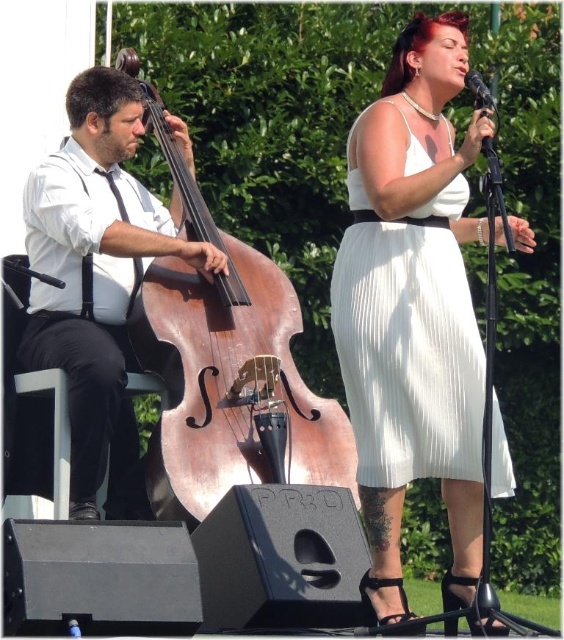
You are a stagehand setting up a storage area. You need to place the matte black double bass at left and the white pleated dress at center into a storage closet. The closet has a maximum capacity of 2 meters in height. Can both items fit vertically in the closet if the double bass is 1.8 meters tall and the dress is 1.2 meters tall?

The matte black double bass at left is bigger than the white pleated dress at center. The double bass is 1.8 meters tall, which exceeds the 2 meters height limit of the closet. Therefore, the double bass cannot fit vertically in the closet, and neither can the dress be placed alongside it since the bass alone is too tall.

You are a stagehand adjusting the lighting for the performance. You need to position a spotlight so it shines on both the matte black double bass at left and the black matte microphone at upper right. Given their positions, which object should you aim the spotlight towards first to ensure both are illuminated?

Since the matte black double bass at left is to the left of the black matte microphone at upper right, you should aim the spotlight towards the matte black double bass at left first. This way, the light will naturally spread towards the microphone at upper right, ensuring both are illuminated.

You are a photographer at the live performance and need to frame both the matte black double bass at left and the white pleated dress at center in your shot. Which object should you adjust your camera angle to prioritize if you want to capture the wider object?

The matte black double bass at left is wider than the white pleated dress at center, so you should prioritize capturing the matte black double bass at left to ensure its full width is in the frame.